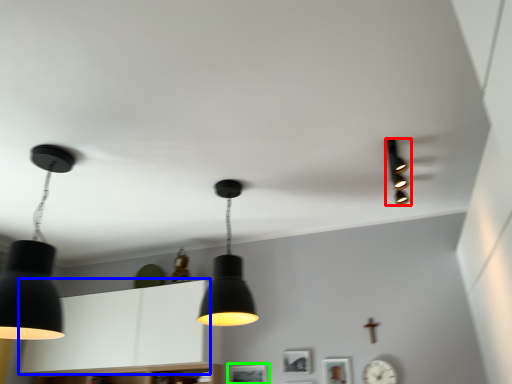
Question: Estimate the real-world distances between objects in this image. Which object is farther from lamp (highlighted by a red box), cabinetry (highlighted by a blue box) or picture frame (highlighted by a green box)?

Choices:
 (A) cabinetry
 (B) picture frame

Answer: (A)